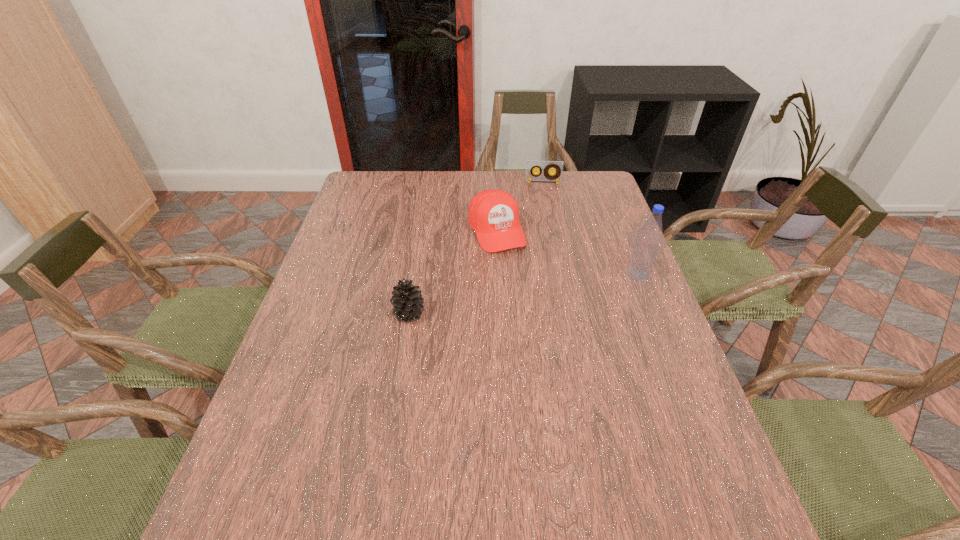
The image size is (960, 540). In order to click on free space on the desktop that is between the leftmost object and the second nearest object and is positioned on the front panel of the baseball cap in this screenshot , I will do `click(530, 293)`.

You are a GUI agent. You are given a task and a screenshot of the screen. Output one action in this format:
    pyautogui.click(x=<x>, y=<y>)
    Task: Click on the free spot on the desktop that is between the pinecone and the rightmost object and is positioned at the front of the videotape with visible reels
    The width and height of the screenshot is (960, 540).
    Given the screenshot: What is the action you would take?
    pyautogui.click(x=548, y=289)